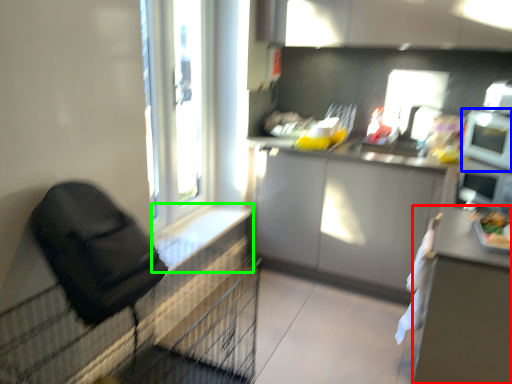
Question: Considering the real-world distances, which object is farthest from table (highlighted by a red box)? appliance (highlighted by a blue box) or window sill (highlighted by a green box)?

Choices:
 (A) appliance
 (B) window sill

Answer: (B)